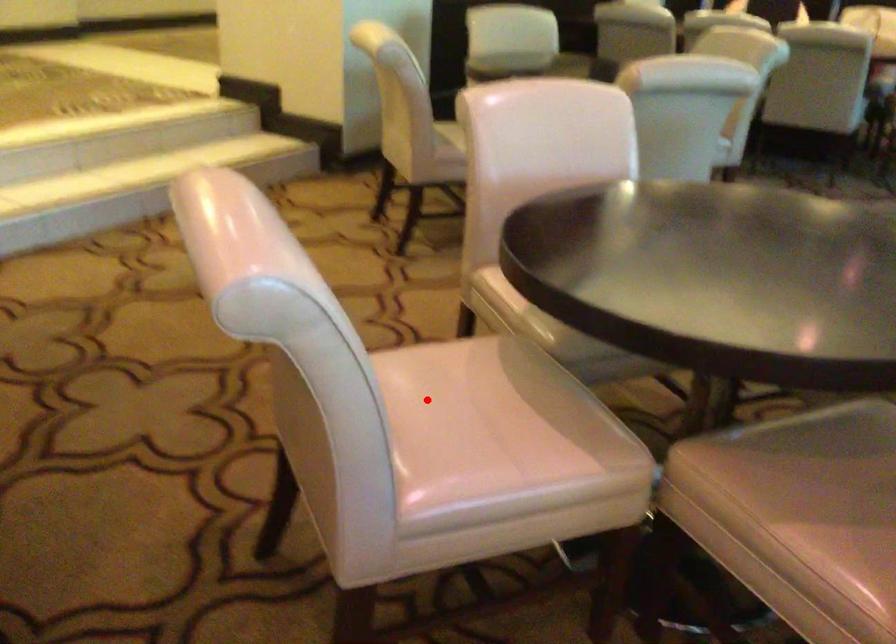
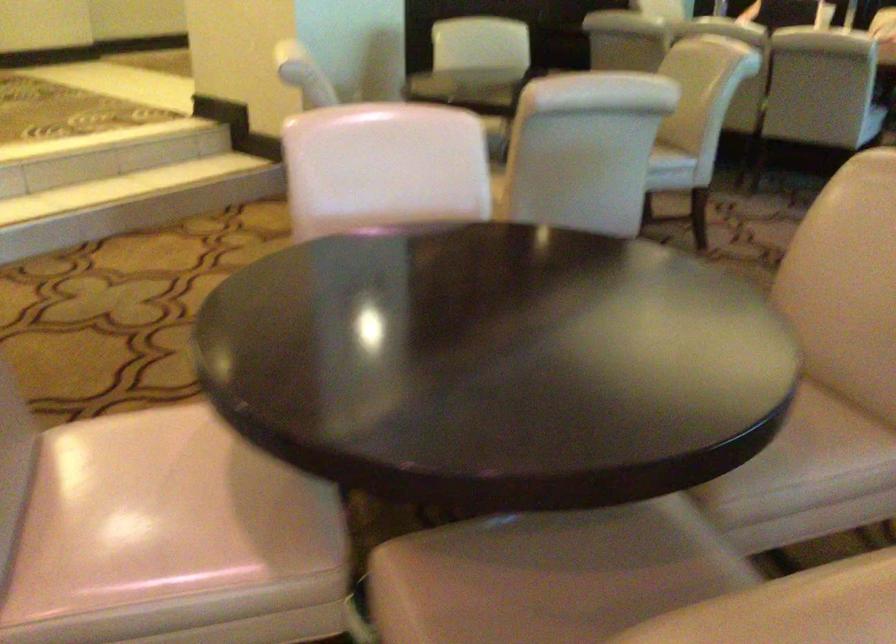
Question: I am providing you with two images of the same scene from different viewpoints. In image1, a red point is highlighted. Considering the same 3D point in image2, which of the following is correct?

Choices:
 (A) It is closer
 (B) It is farther

Answer: (A)